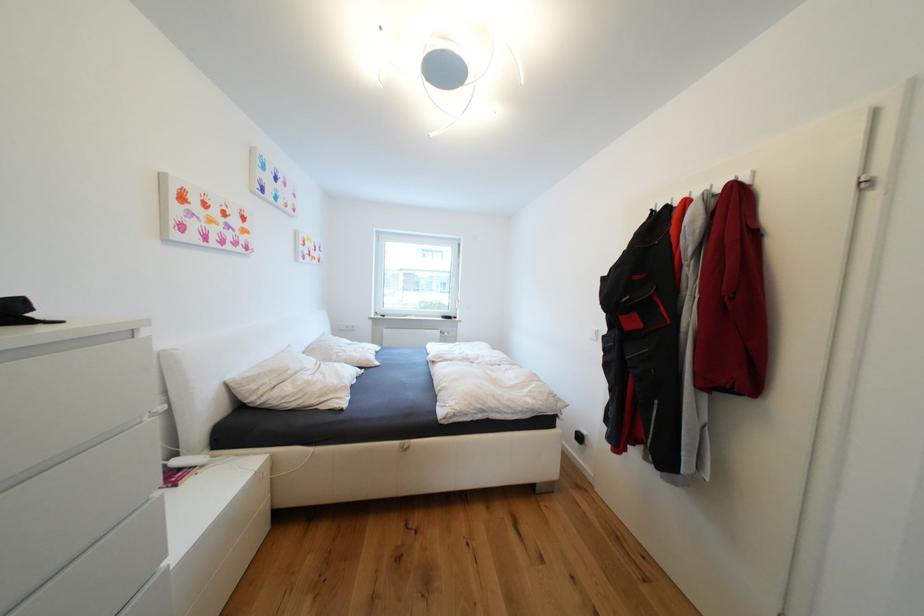
Find where to pull the white drawer front. Please return your answer as a coordinate pair (x, y).

(76, 461)